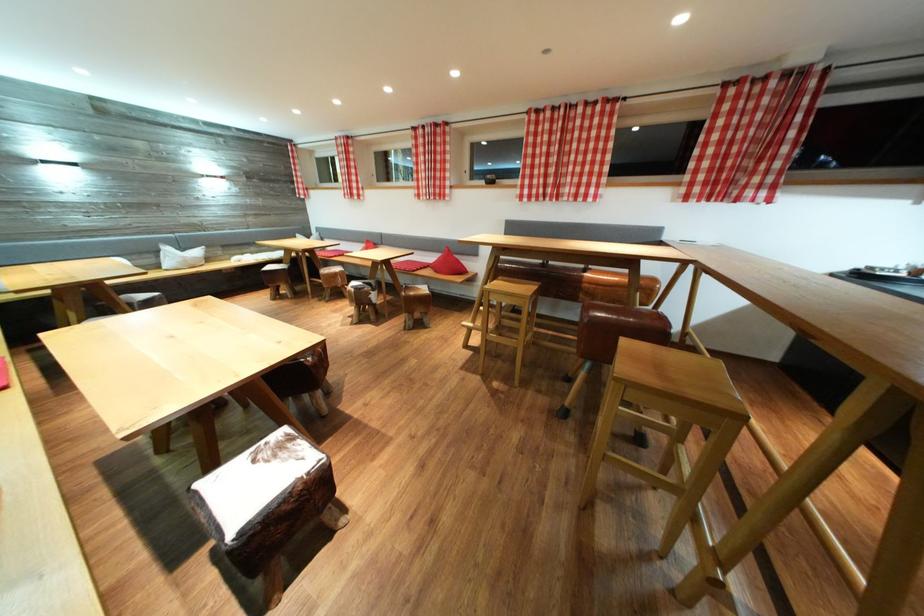
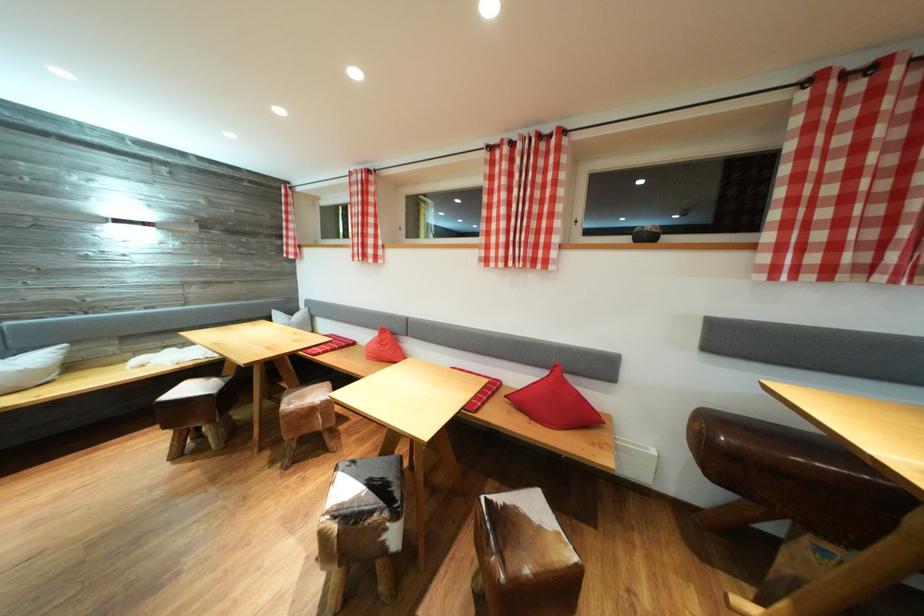
Find the pixel in the second image that matches [548,111] in the first image.

(869, 66)